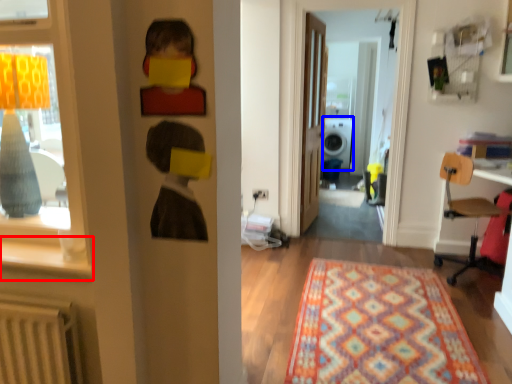
Question: Which object appears farthest to the camera in this image, window sill (highlighted by a red box) or washer (highlighted by a blue box)?

Choices:
 (A) window sill
 (B) washer

Answer: (B)